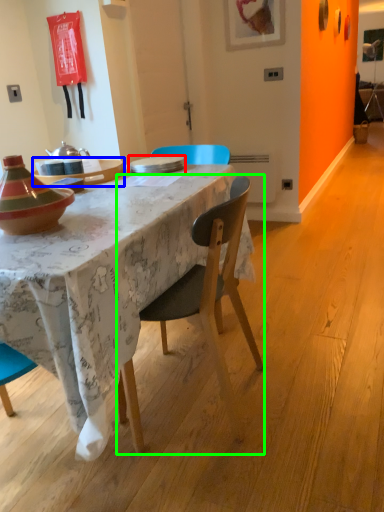
Question: Which object is the closest to the plate (highlighted by a red box)? Choose among these: table (highlighted by a blue box) or chair (highlighted by a green box).

Choices:
 (A) table
 (B) chair

Answer: (A)